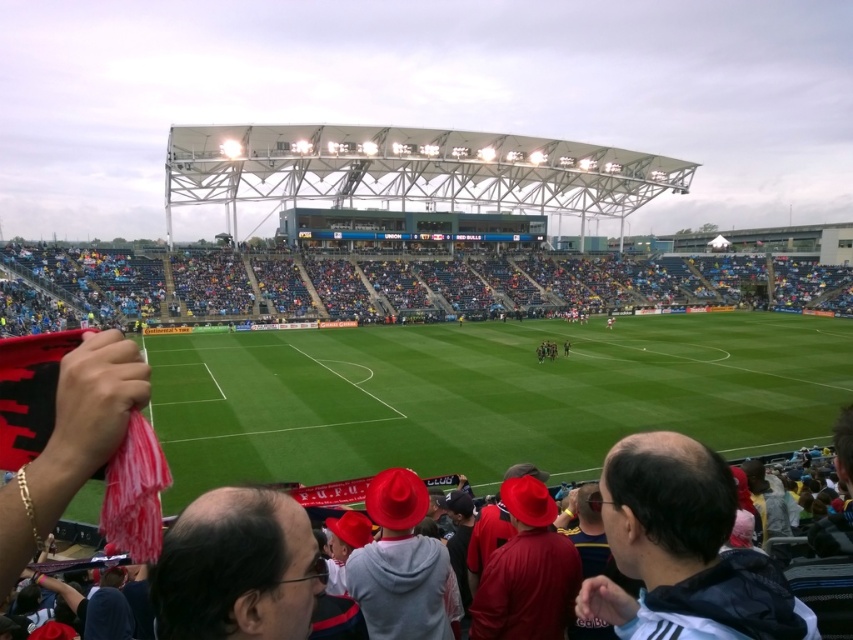
Question: Can you confirm if red fabric at lower left is thinner than dark gray jacket at lower right?

Choices:
 (A) yes
 (B) no

Answer: (B)

Question: Observing the image, what is the correct spatial positioning of red fabric at lower left in reference to dark gray jacket at lower right?

Choices:
 (A) right
 (B) left

Answer: (A)

Question: Can you confirm if red fabric at lower left is thinner than dark gray jacket at lower right?

Choices:
 (A) yes
 (B) no

Answer: (B)

Question: Which of the following is the farthest from the observer?

Choices:
 (A) red fabric at lower left
 (B) dark gray jacket at lower right

Answer: (A)

Question: Which of the following is the farthest from the observer?

Choices:
 (A) dark gray jacket at lower right
 (B) red fabric at lower left

Answer: (B)